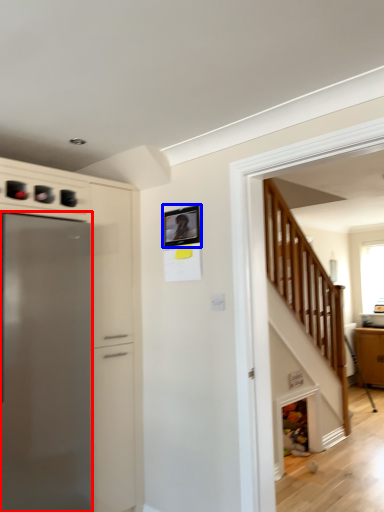
Question: Which object appears farthest to the camera in this image, refrigerator (highlighted by a red box) or picture frame (highlighted by a blue box)?

Choices:
 (A) refrigerator
 (B) picture frame

Answer: (B)